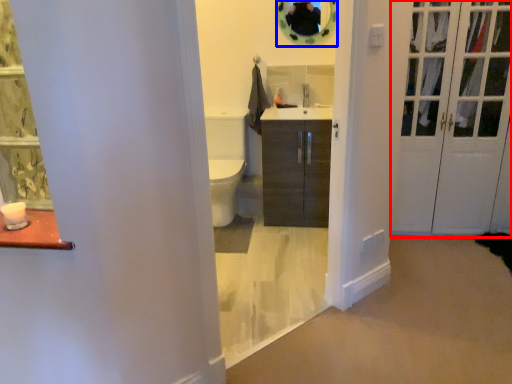
Question: Which object appears closest to the camera in this image, door (highlighted by a red box) or mirror (highlighted by a blue box)?

Choices:
 (A) door
 (B) mirror

Answer: (A)